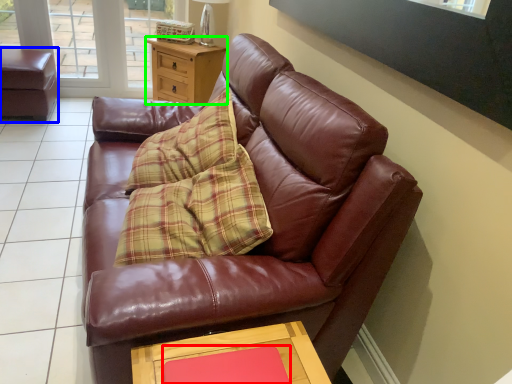
Question: Which is farther away from flat (highlighted by a red box)? swivel chair (highlighted by a blue box) or side table (highlighted by a green box)?

Choices:
 (A) swivel chair
 (B) side table

Answer: (A)